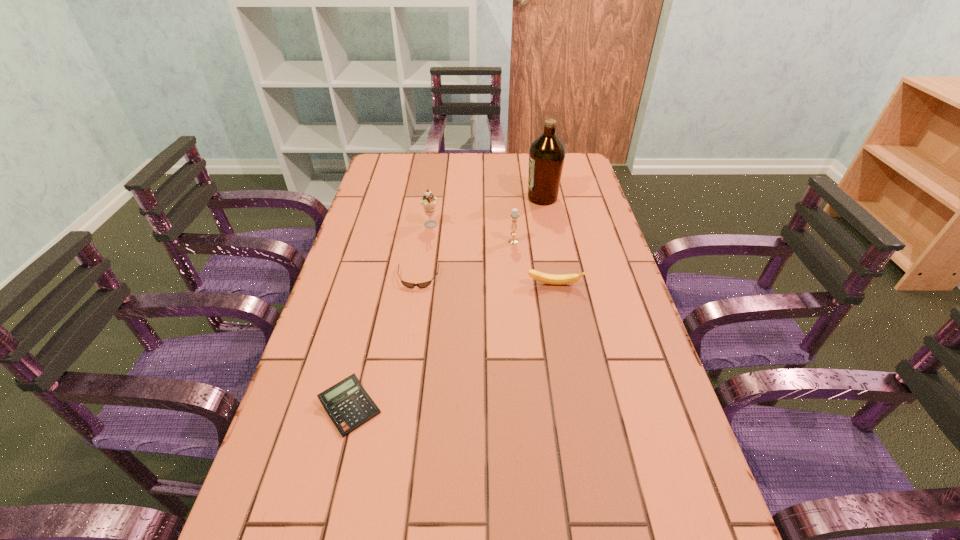
Locate an element on the screen. olive oil is located at coordinates (547, 153).

This screenshot has height=540, width=960. Identify the location of the farthest object. (547, 153).

Find the location of a particular element. the fifth shortest object is located at coordinates (428, 201).

Locate an element on the screen. The height and width of the screenshot is (540, 960). the second farthest object is located at coordinates pos(428,201).

The height and width of the screenshot is (540, 960). Identify the location of the fourth nearest object. (514, 216).

Locate an element on the screen. the third object from right to left is located at coordinates (514, 216).

This screenshot has height=540, width=960. Identify the location of banana. (553, 279).

You are a GUI agent. You are given a task and a screenshot of the screen. Output one action in this format:
    pyautogui.click(x=<x>, y=<y>)
    Task: Click on the calculator
    The height and width of the screenshot is (540, 960).
    Given the screenshot: What is the action you would take?
    pyautogui.click(x=348, y=405)

Where is `the fifth tallest object`? The width and height of the screenshot is (960, 540). the fifth tallest object is located at coordinates (348, 405).

This screenshot has width=960, height=540. Find the location of `the shortest object`. the shortest object is located at coordinates (409, 285).